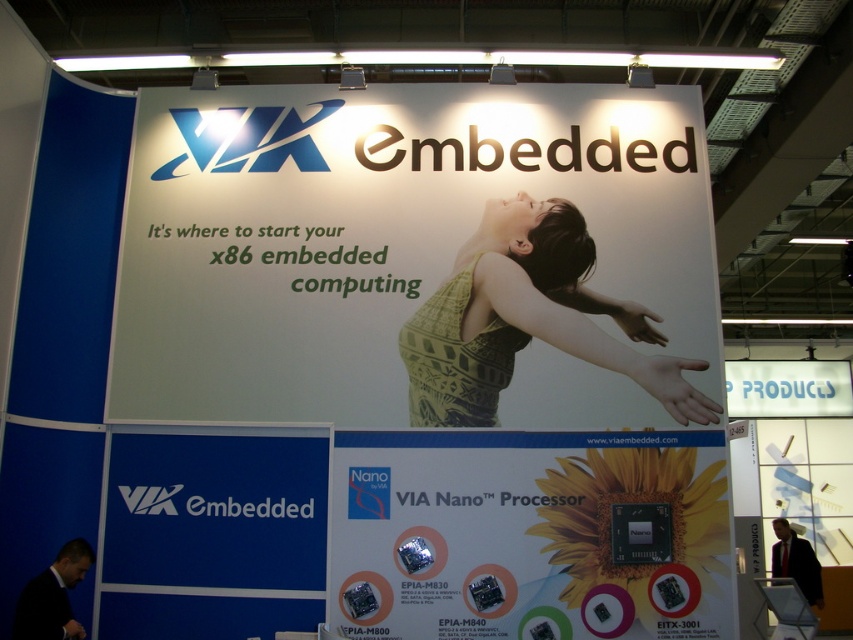
Describe the element at coordinates (415, 257) in the screenshot. The image size is (853, 640). I see `white paper billboard at center` at that location.

Between white paper billboard at center and silvery metallic via nano processor at center, which one has less height?

silvery metallic via nano processor at center

Is point (229, 186) positioned after point (355, 467)?

That is True.

This screenshot has height=640, width=853. I want to click on white paper billboard at center, so click(x=415, y=257).

Can you confirm if white paper billboard at center is smaller than green knitted tank top at center?

No.

Between point (489, 413) and point (505, 323), which one is positioned in front?

Point (489, 413) is in front.

The height and width of the screenshot is (640, 853). What do you see at coordinates (415, 257) in the screenshot? I see `white paper billboard at center` at bounding box center [415, 257].

Where is `white paper billboard at center`? white paper billboard at center is located at coordinates (415, 257).

Is silvery metallic via nano processor at center positioned before green knitted tank top at center?

Yes.

Does silvery metallic via nano processor at center have a lesser height compared to green knitted tank top at center?

Yes.

Is point (706, 448) closer to camera compared to point (691, 396)?

Yes, it is in front of point (691, 396).

The image size is (853, 640). In order to click on silvery metallic via nano processor at center in this screenshot , I will do `click(529, 534)`.